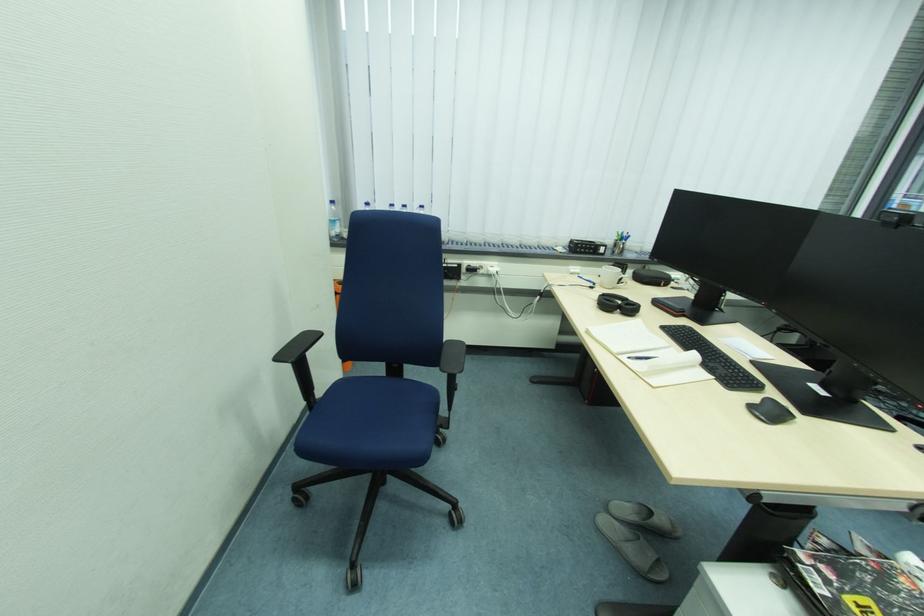
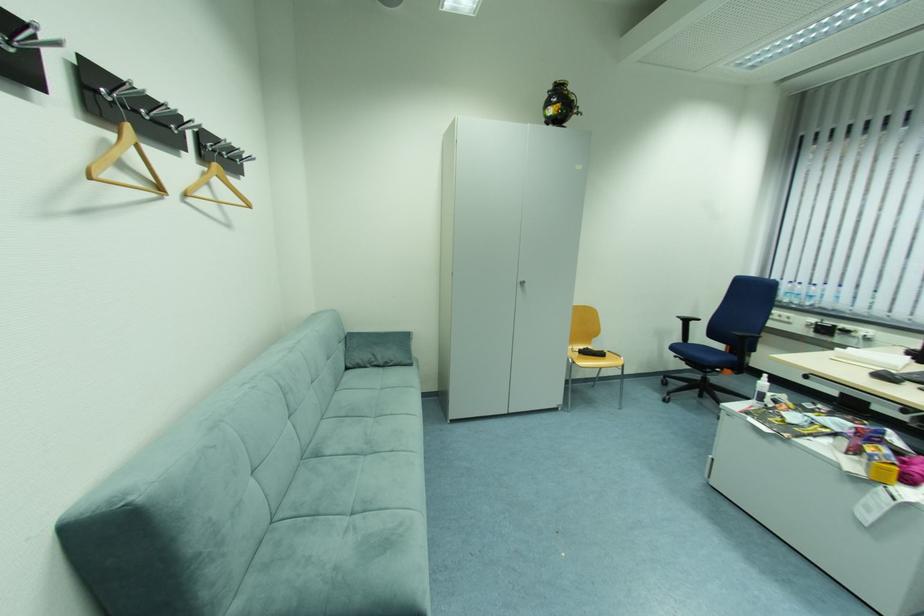
Where in the second image is the point corresponding to (284,361) from the first image?

(685, 318)